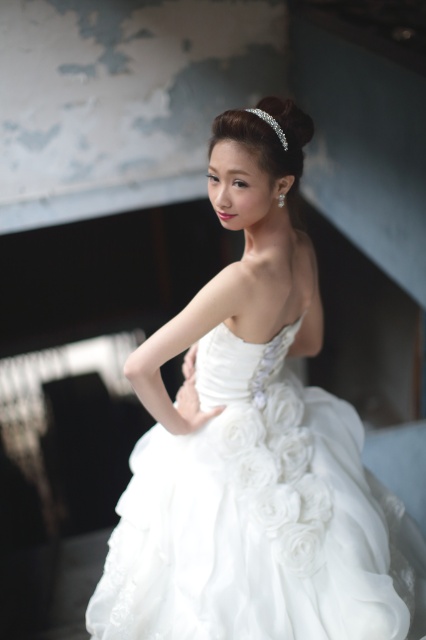
You are a photographer setting up for a wedding photoshoot. The white satin dress at center belongs to the bride, and the clear crystal tiara at upper center is part of her bridal accessories. You need to position a light source between them to evenly illuminate both items. Given their distance apart, what is the minimum distance the light should be placed from each object to ensure both are equally lit?

The white satin dress at center and clear crystal tiara at upper center are 26.36 inches apart. To ensure both are equally lit, the light source should be placed exactly halfway between them, which would be 13.18 inches away from each object.

You are a photographer setting up for a wedding photoshoot. You need to ensure that both the white satin dress at center and the clear crystal tiara at upper center are visible in the frame. Based on their sizes, which object should you focus on first to ensure proper framing?

The white satin dress at center is taller than the clear crystal tiara at upper center. Therefore, you should focus on framing the white satin dress at center first to ensure it fits within the shot, as it is the larger object.

You are a photographer setting up for a photoshoot. You need to ensure that both the white satin dress at center and the clear crystal tiara at upper center are visible in the shot. Based on their positions, which object should you focus on first to ensure both are in frame?

The white satin dress at center is in front of the clear crystal tiara at upper center, so you should focus on the clear crystal tiara at upper center first to ensure it is visible behind the dress.